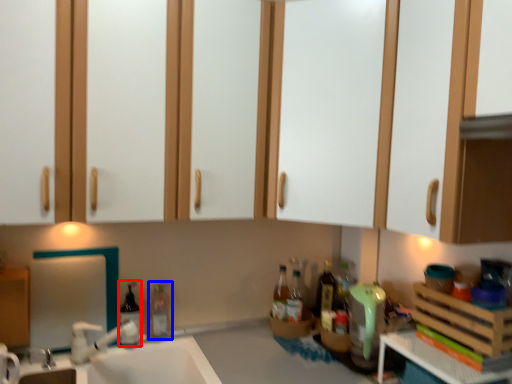
Question: Which object is closer to the camera taking this photo, bottle (highlighted by a red box) or bottle (highlighted by a blue box)?

Choices:
 (A) bottle
 (B) bottle

Answer: (A)